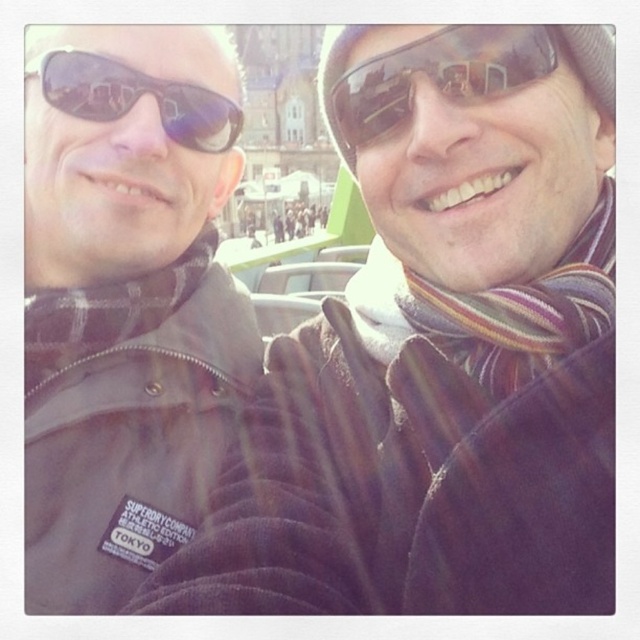
Question: Considering the relative positions of matte black jacket at left and matte brown jacket at center in the image provided, where is matte black jacket at left located with respect to matte brown jacket at center?

Choices:
 (A) left
 (B) right

Answer: (B)

Question: Does matte black goggles at upper center lie behind matte brown jacket at center?

Choices:
 (A) no
 (B) yes

Answer: (A)

Question: Which point is closer to the camera?

Choices:
 (A) matte black goggles at upper center
 (B) matte black sunglasses at upper left
 (C) matte brown jacket at center
 (D) brown corduroy jacket at left

Answer: (D)

Question: Does brown corduroy jacket at left have a lesser width compared to matte black sunglasses at upper left?

Choices:
 (A) yes
 (B) no

Answer: (B)

Question: Which object is the farthest from the matte black sunglasses at upper left?

Choices:
 (A) brown corduroy jacket at left
 (B) matte black goggles at upper center
 (C) matte brown jacket at center

Answer: (C)

Question: Which point appears farthest from the camera in this image?

Choices:
 (A) (180, 115)
 (B) (282, 216)
 (C) (465, 49)

Answer: (B)